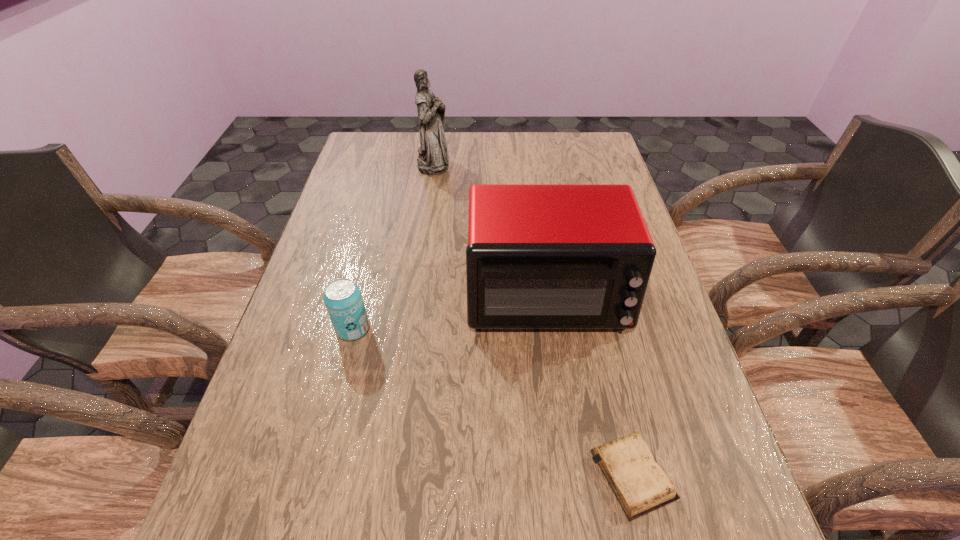
I want to click on vacant space located on the right of the diary, so click(707, 474).

Find the location of a particular element. This screenshot has height=540, width=960. object at the far edge is located at coordinates (432, 159).

At what (x,y) coordinates should I click in order to perform the action: click on object at the left edge. Please return your answer as a coordinate pair (x, y). Looking at the image, I should click on (342, 297).

At what (x,y) coordinates should I click in order to perform the action: click on toaster oven present at the right edge. Please return your answer as a coordinate pair (x, y). This screenshot has width=960, height=540. Looking at the image, I should click on (540, 256).

You are a GUI agent. You are given a task and a screenshot of the screen. Output one action in this format:
    pyautogui.click(x=<x>, y=<y>)
    Task: Click on the diary that is at the right edge
    
    Given the screenshot: What is the action you would take?
    pyautogui.click(x=640, y=484)

Find the location of a particular element. The width and height of the screenshot is (960, 540). free space at the far edge is located at coordinates (491, 161).

Locate an element on the screen. vacant region at the left edge of the desktop is located at coordinates (374, 222).

This screenshot has height=540, width=960. I want to click on vacant space at the far left corner of the desktop, so click(383, 153).

This screenshot has width=960, height=540. I want to click on vacant area that lies between the second tallest object and the leftmost object, so click(x=449, y=312).

The image size is (960, 540). What are the coordinates of `free spot between the toaster oven and the diary` in the screenshot? It's located at click(589, 384).